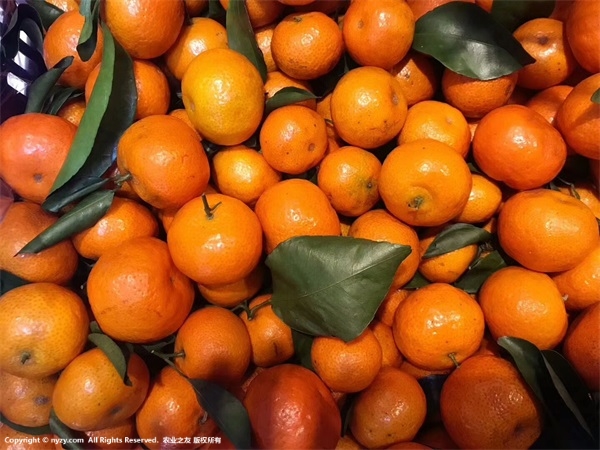
At what (x,y) coordinates should I click in order to perform the action: click on left side of plastic crate. Please return your answer as a coordinate pair (x, y). This screenshot has height=450, width=600. Looking at the image, I should click on (8, 90).